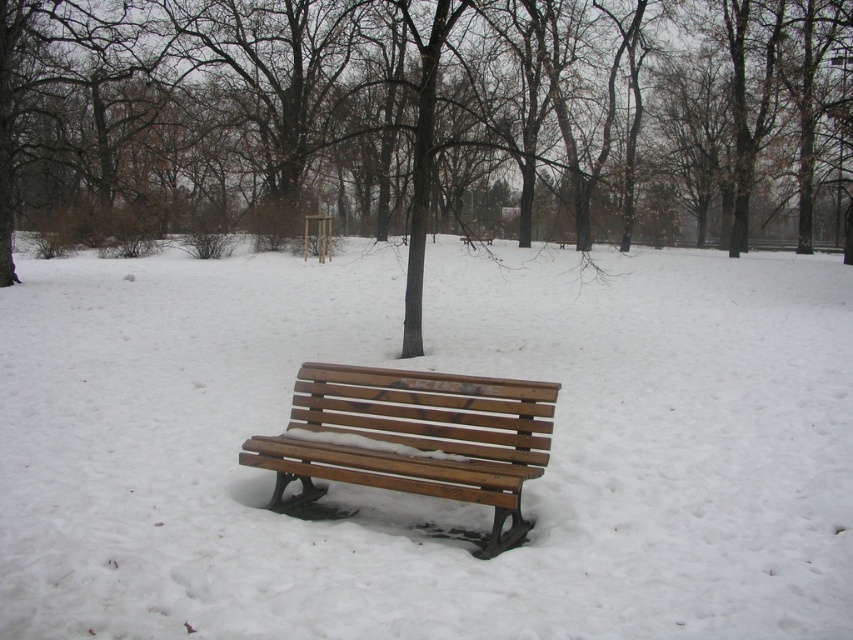
Does white matte snow at center have a lesser height compared to brown wood tree at center?

Correct, white matte snow at center is not as tall as brown wood tree at center.

Is point (173, 596) farther from camera compared to point (442, 228)?

No, (173, 596) is in front of (442, 228).

What are the coordinates of `white matte snow at center` in the screenshot? It's located at (426, 497).

Find the location of `white matte snow at center`. white matte snow at center is located at coordinates (426, 497).

Is point (596, 435) closer to camera compared to point (469, 413)?

That is False.

Is white matte snow at center to the left of wooden bench at center from the viewer's perspective?

Yes, white matte snow at center is to the left of wooden bench at center.

The width and height of the screenshot is (853, 640). What do you see at coordinates (426, 497) in the screenshot? I see `white matte snow at center` at bounding box center [426, 497].

Find the location of `white matte snow at center`. white matte snow at center is located at coordinates (426, 497).

Is brown wood tree at center behind wooden bench at center?

That is True.

Is point (138, 248) farther from viewer compared to point (358, 436)?

Yes, it is.

Does point (357, 109) come in front of point (451, 465)?

No, it is not.

Locate an element on the screen. Image resolution: width=853 pixels, height=640 pixels. brown wood tree at center is located at coordinates (425, 124).